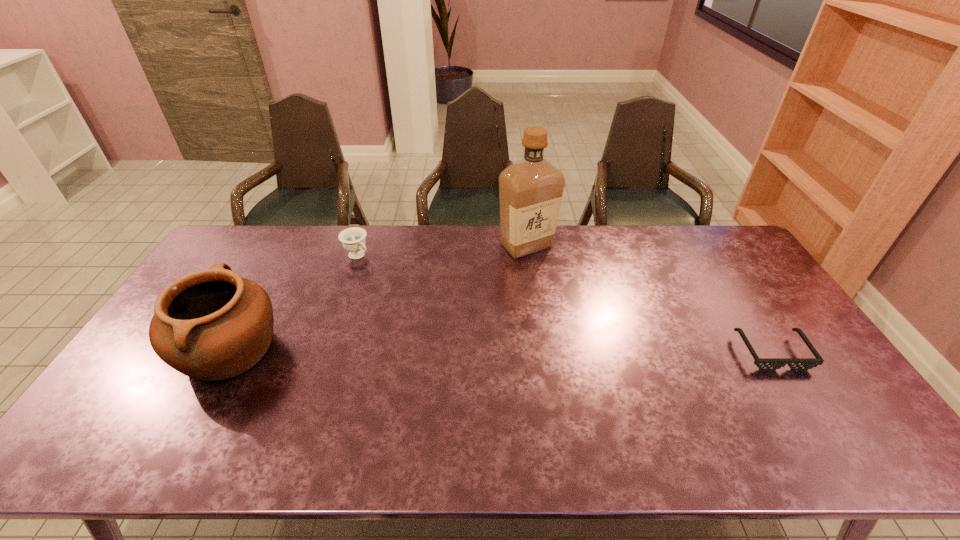
Identify the location of vacant space situated on the front-facing side of the liquor. Image resolution: width=960 pixels, height=540 pixels. 525,289.

This screenshot has height=540, width=960. Find the location of `vacant point located 0.270m on the front-facing side of the liquor`. vacant point located 0.270m on the front-facing side of the liquor is located at coordinates point(524,318).

This screenshot has height=540, width=960. I want to click on vacant space situated on the front-facing side of the liquor, so click(x=524, y=315).

I want to click on vacant space situated on the side of the third tallest object with the handle, so click(x=417, y=304).

Locate an element on the screen. This screenshot has height=540, width=960. free point located 0.160m on the side of the third tallest object with the handle is located at coordinates (392, 284).

The image size is (960, 540). Find the location of `vacant space located on the side of the third tallest object with the handle`. vacant space located on the side of the third tallest object with the handle is located at coordinates (403, 293).

This screenshot has height=540, width=960. I want to click on liquor that is at the far edge, so click(x=530, y=190).

Where is `teacup located in the far edge section of the desktop`? This screenshot has height=540, width=960. teacup located in the far edge section of the desktop is located at coordinates (353, 239).

Locate an element on the screen. object that is at the near edge is located at coordinates (212, 324).

Locate an element on the screen. This screenshot has height=540, width=960. object located at the left edge is located at coordinates (212, 324).